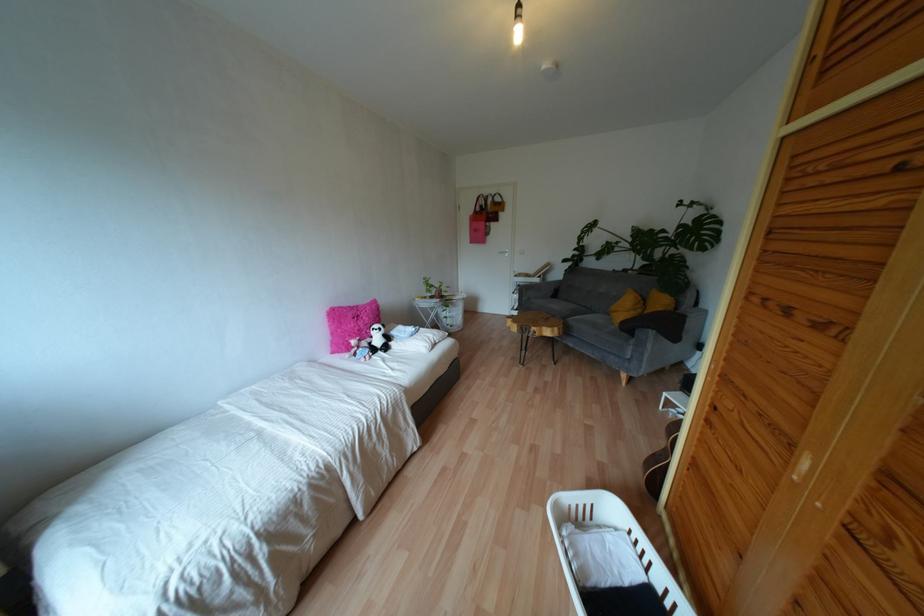
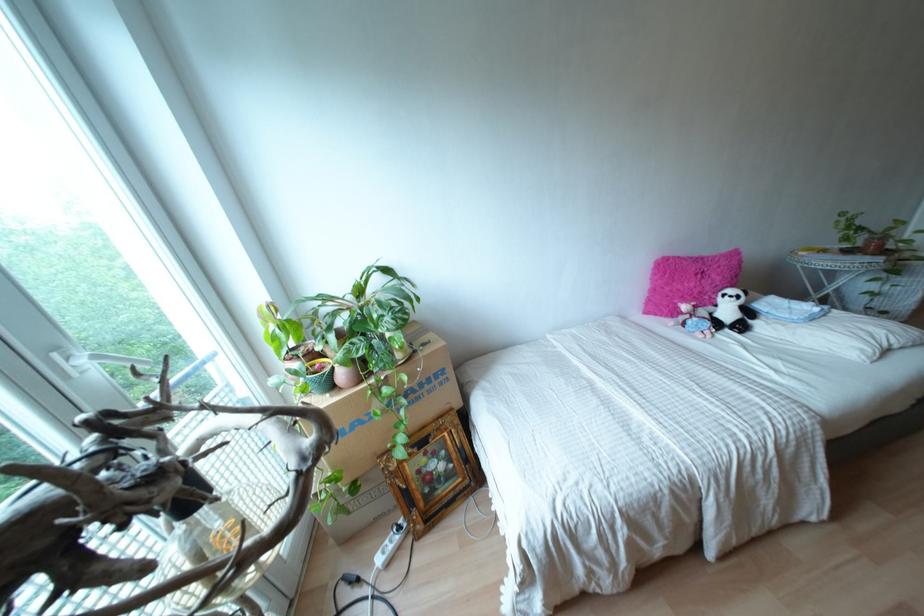
The point at (368, 339) is marked in the first image. Where is the corresponding point in the second image?

(710, 308)